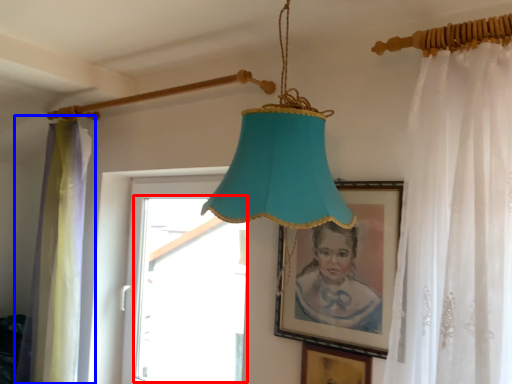
Question: Which of the following is the farthest to the observer, window (highlighted by a red box) or curtain (highlighted by a blue box)?

Choices:
 (A) window
 (B) curtain

Answer: (B)